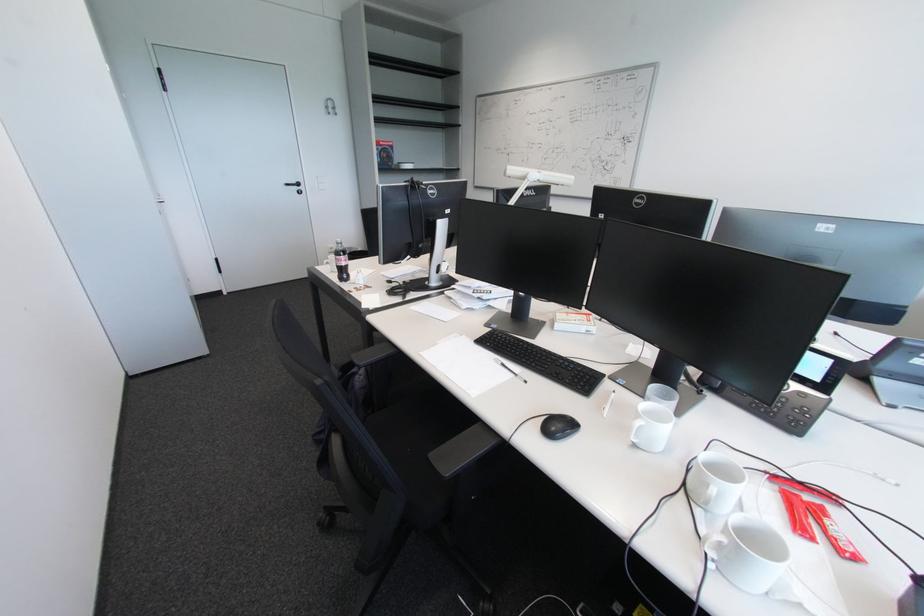
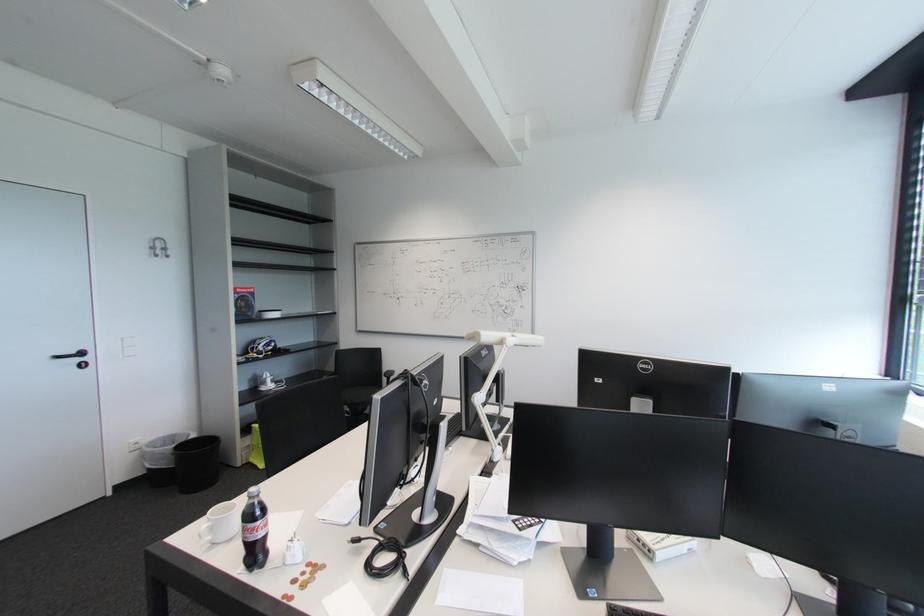
Locate, in the second image, the point that corresponds to (x=334, y=108) in the first image.

(159, 249)